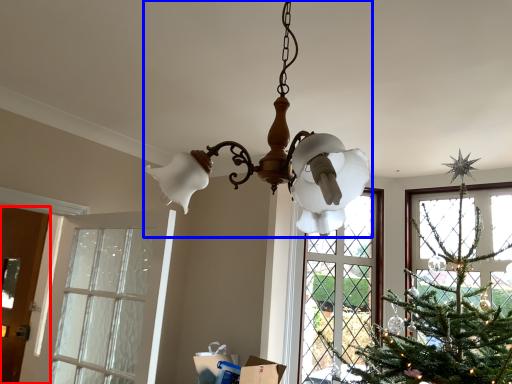
Question: Which point is further to the camera, door (highlighted by a red box) or lamp (highlighted by a blue box)?

Choices:
 (A) door
 (B) lamp

Answer: (A)